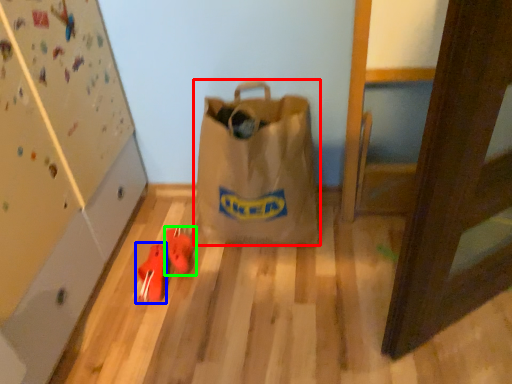
Question: Which is farther away from luggage and bags (highlighted by a red box)? footwear (highlighted by a blue box) or footwear (highlighted by a green box)?

Choices:
 (A) footwear
 (B) footwear

Answer: (A)